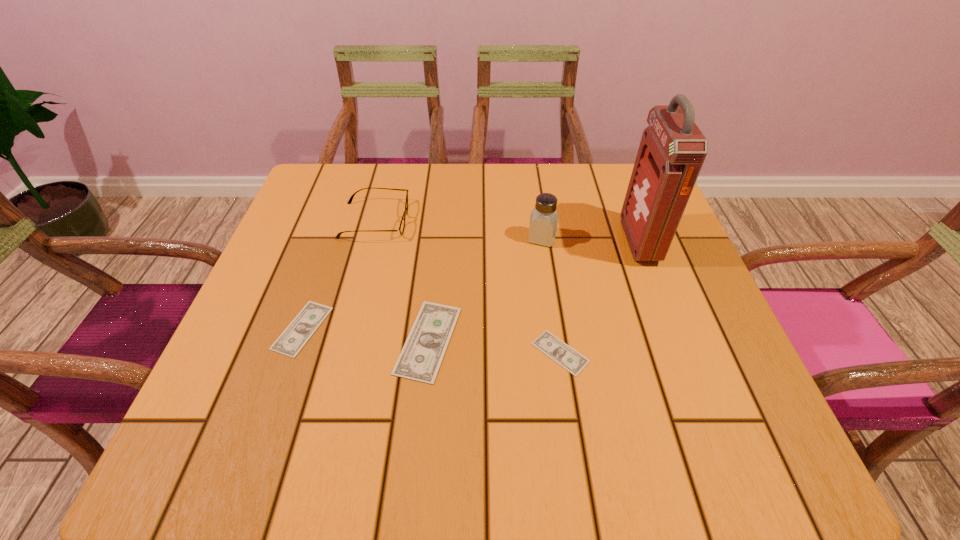
Locate an element on the screen. The image size is (960, 540). the leftmost money is located at coordinates (300, 330).

You are a GUI agent. You are given a task and a screenshot of the screen. Output one action in this format:
    pyautogui.click(x=<x>, y=<y>)
    Task: Click on the second shortest object
    This screenshot has width=960, height=540.
    Given the screenshot: What is the action you would take?
    pyautogui.click(x=300, y=330)

Find the location of a particular element. the tallest money is located at coordinates (420, 359).

This screenshot has height=540, width=960. I want to click on the fourth object from right to left, so click(420, 359).

This screenshot has height=540, width=960. In order to click on the shortest object in this screenshot , I will do `click(550, 345)`.

Locate an element on the screen. the shortest money is located at coordinates (550, 345).

At what (x,y) coordinates should I click in order to perform the action: click on spectacles. Please return your answer as a coordinate pair (x, y). This screenshot has height=540, width=960. Looking at the image, I should click on (402, 225).

Locate an element on the screen. Image resolution: width=960 pixels, height=540 pixels. saltshaker is located at coordinates (544, 217).

Where is `the rightmost object`? The height and width of the screenshot is (540, 960). the rightmost object is located at coordinates (672, 150).

Where is `the first-aid kit`? The height and width of the screenshot is (540, 960). the first-aid kit is located at coordinates (672, 150).